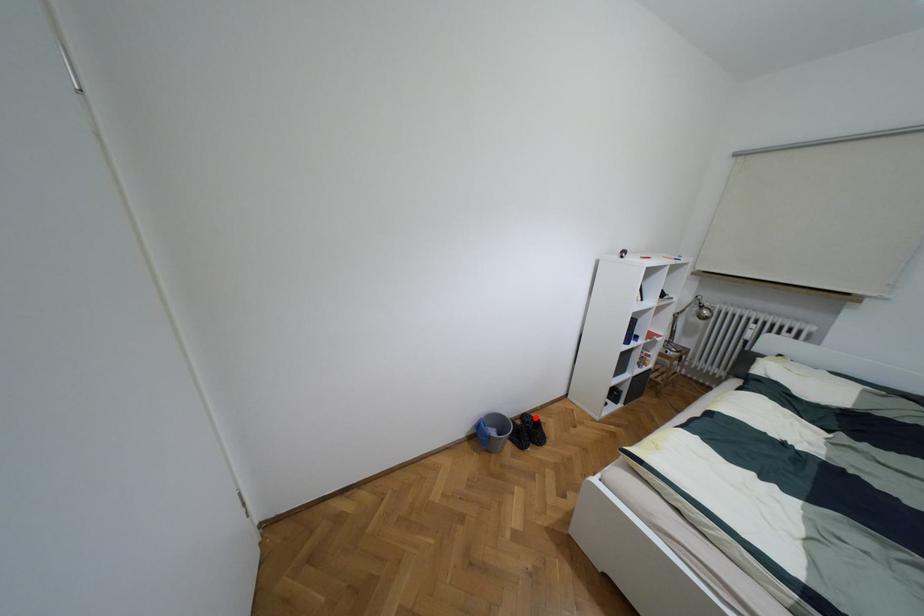
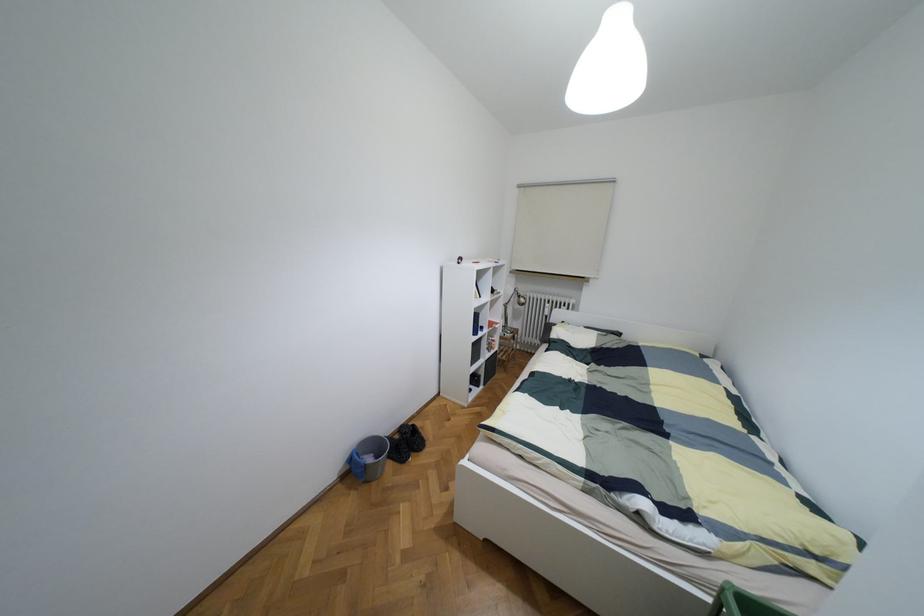
Find the pixel in the second image that matches the highlighted location in the first image.

(412, 424)